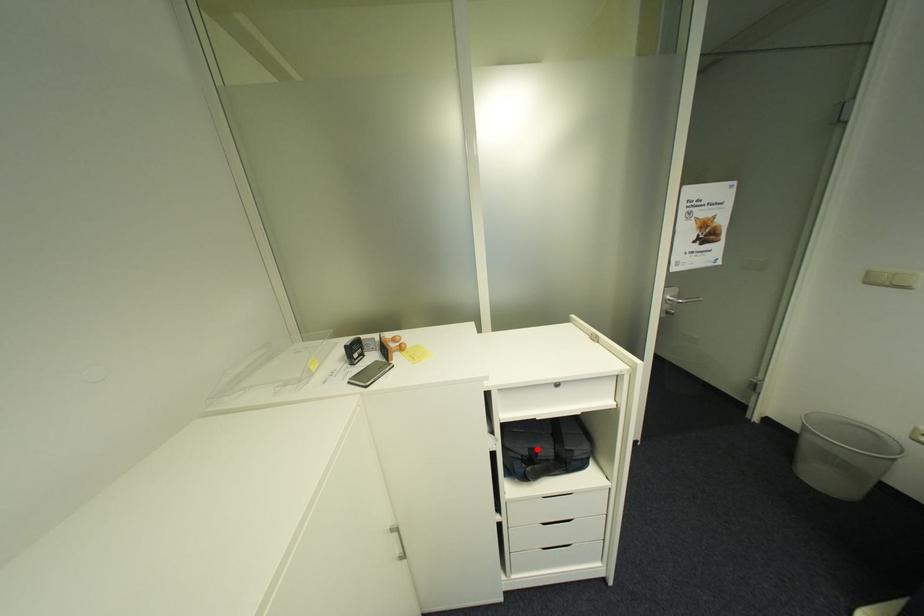
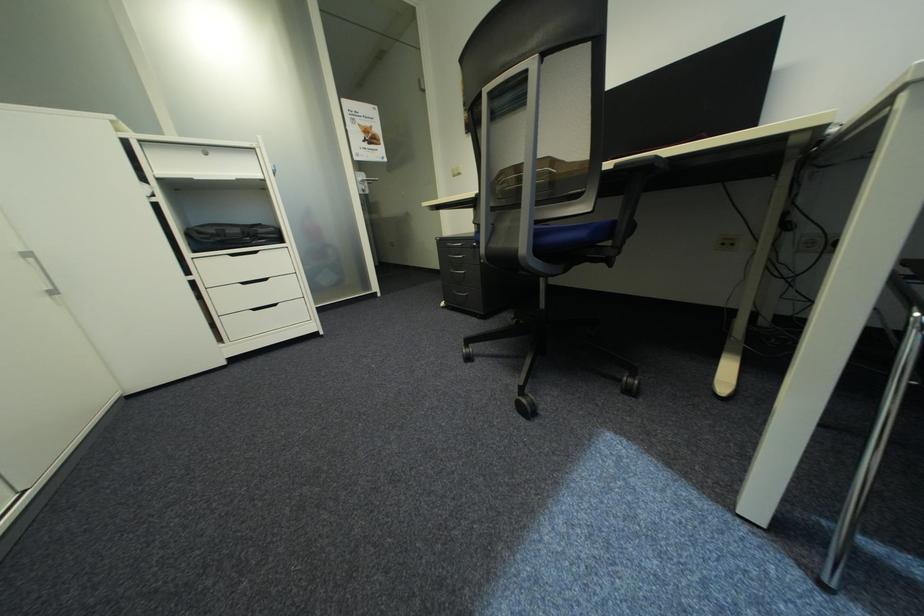
Question: I am providing you with two images of the same scene from different viewpoints. A red point is marked on the first image. Is the red point's position out of view in image 2?

Choices:
 (A) Yes
 (B) No

Answer: (B)